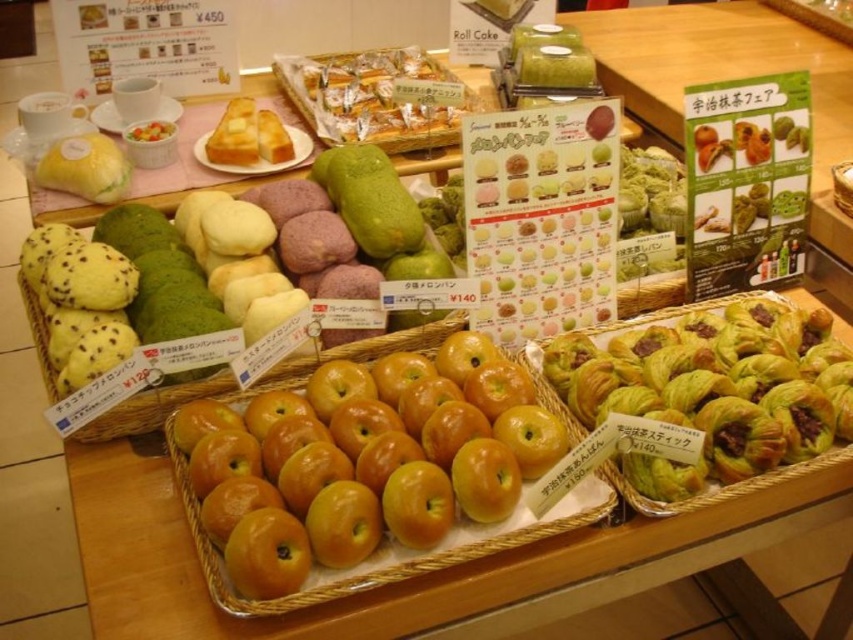
Question: Is yellow matte apples at center to the right of golden-brown crispy pastry at center from the viewer's perspective?

Choices:
 (A) yes
 (B) no

Answer: (A)

Question: Does yellow matte apples at center appear over golden-brown crispy pastry at center?

Choices:
 (A) no
 (B) yes

Answer: (A)

Question: Which is nearer to the yellow matte apples at center?

Choices:
 (A) green flaky pastry at lower right
 (B) golden-brown crispy pastry at center

Answer: (A)

Question: Which of these objects is positioned farthest from the golden-brown crispy pastry at center?

Choices:
 (A) green flaky pastry at lower right
 (B) yellow matte apples at center

Answer: (B)

Question: Estimate the real-world distances between objects in this image. Which object is closer to the green flaky pastry at lower right?

Choices:
 (A) golden-brown crispy pastry at center
 (B) yellow matte apples at center

Answer: (B)

Question: Is yellow matte apples at center below golden-brown crispy pastry at center?

Choices:
 (A) no
 (B) yes

Answer: (B)